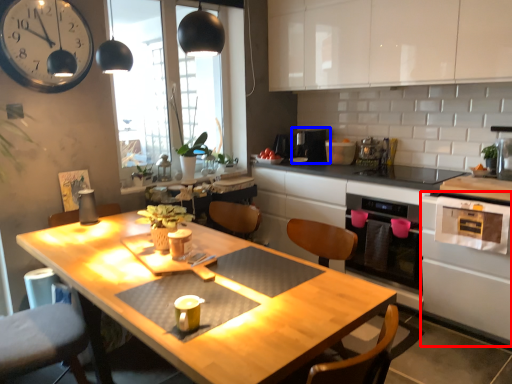
Question: Which point is closer to the camera, oven (highlighted by a red box) or appliance (highlighted by a blue box)?

Choices:
 (A) oven
 (B) appliance

Answer: (A)